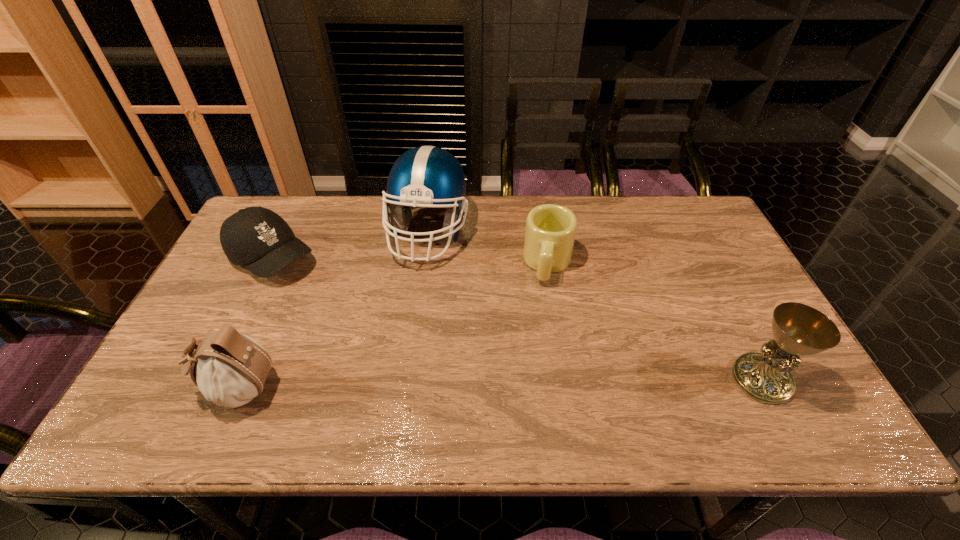
Locate an element on the screen. vacant space at the right edge of the desktop is located at coordinates (765, 333).

I want to click on free space at the far right corner of the desktop, so coord(718,238).

Locate an element on the screen. The height and width of the screenshot is (540, 960). free space between the mug and the baseball cap is located at coordinates (410, 261).

Where is `empty location between the baseball cap and the mug`? The width and height of the screenshot is (960, 540). empty location between the baseball cap and the mug is located at coordinates (410, 261).

Locate an element on the screen. free space between the tallest object and the baseball cap is located at coordinates (350, 245).

Image resolution: width=960 pixels, height=540 pixels. In order to click on free area in between the pouch and the third object from right to left in this screenshot , I will do `click(333, 310)`.

Where is `unoccupied position between the pouch and the rightmost object`? This screenshot has height=540, width=960. unoccupied position between the pouch and the rightmost object is located at coordinates (499, 383).

I want to click on free space between the football helmet and the pouch, so click(333, 310).

Where is `unoccupied position between the pouch and the chalice`? This screenshot has height=540, width=960. unoccupied position between the pouch and the chalice is located at coordinates (499, 383).

The width and height of the screenshot is (960, 540). Find the location of `free point between the pouch and the second object from right to left`. free point between the pouch and the second object from right to left is located at coordinates (393, 326).